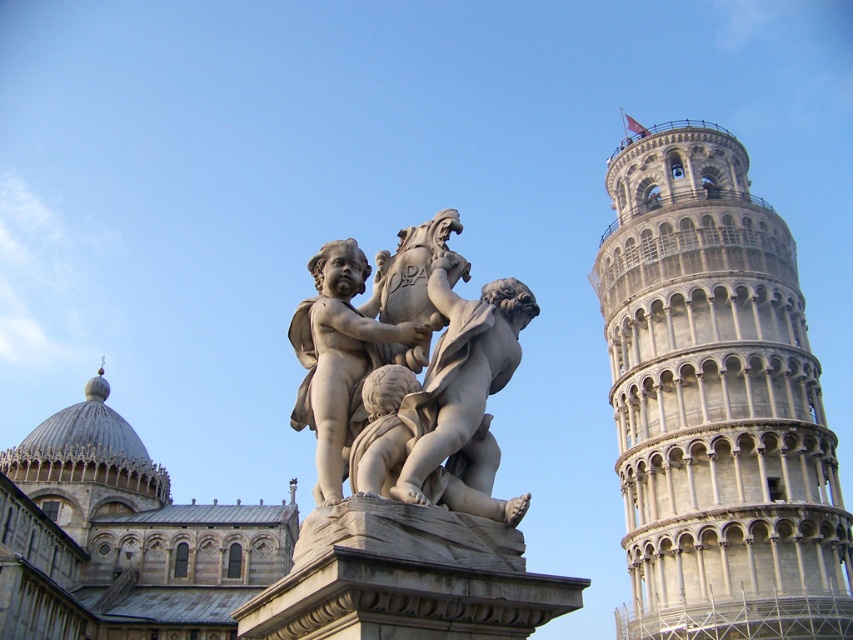
Locate an element on the screen. The width and height of the screenshot is (853, 640). gray stone tower at right is located at coordinates (715, 401).

Identify the location of gray stone tower at right. Image resolution: width=853 pixels, height=640 pixels. (715, 401).

Can you confirm if gray stone tower at right is smaller than white marble statue at center?

Actually, gray stone tower at right might be larger than white marble statue at center.

Which is behind, point (817, 420) or point (322, 310)?

Positioned behind is point (817, 420).

Is point (650, 364) positioned behind point (323, 259)?

Yes.

You are a GUI agent. You are given a task and a screenshot of the screen. Output one action in this format:
    pyautogui.click(x=<x>, y=<y>)
    Task: Click on the gray stone tower at right
    The image size is (853, 640).
    Given the screenshot: What is the action you would take?
    click(x=715, y=401)

Consider the image. Can you confirm if polished stone statue at center is shorter than white marble statue at center?

Yes, polished stone statue at center is shorter than white marble statue at center.

Is point (460, 356) positioned behind point (320, 486)?

Yes, it is behind point (320, 486).

Which is in front, point (453, 326) or point (328, 468)?

Point (328, 468)

At what (x,y) coordinates should I click in order to perform the action: click on polished stone statue at center. Please return your answer as a coordinate pair (x, y). Looking at the image, I should click on (463, 397).